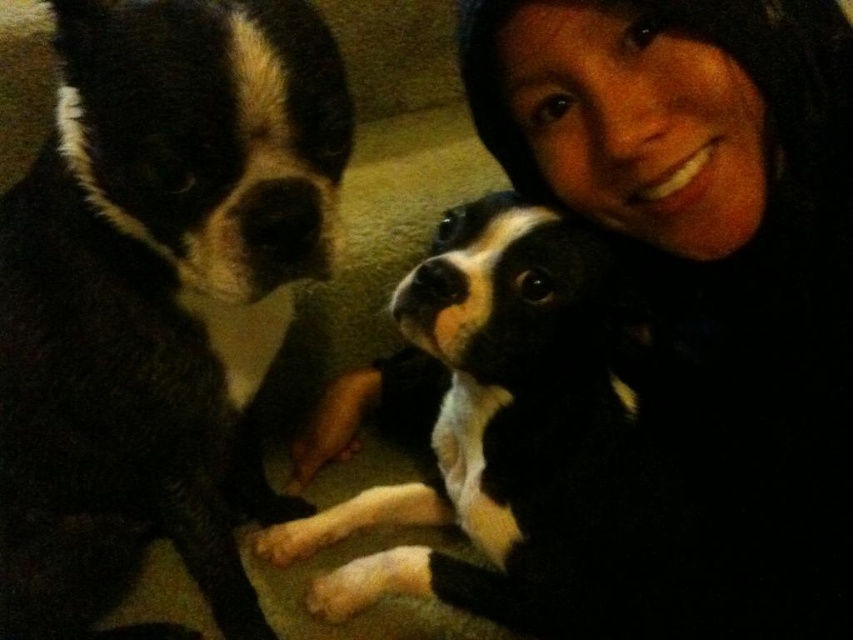
Question: Among these points, which one is nearest to the camera?

Choices:
 (A) (267, 83)
 (B) (328, 401)

Answer: (A)

Question: Can you confirm if black fur dog at left is positioned below black and white fur at center?

Choices:
 (A) no
 (B) yes

Answer: (A)

Question: Which object appears closest to the camera in this image?

Choices:
 (A) black and white fur at center
 (B) black fur dog at left

Answer: (B)

Question: Does black fur dog at left appear over black and white fur at center?

Choices:
 (A) no
 (B) yes

Answer: (B)

Question: Which of the following is the closest to the observer?

Choices:
 (A) black fur dog at left
 (B) black and white fur at center

Answer: (A)

Question: Is black fur dog at left to the left of black and white fur at center from the viewer's perspective?

Choices:
 (A) no
 (B) yes

Answer: (B)